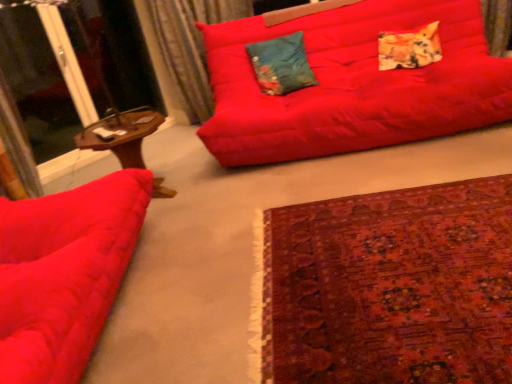
Find the location of a particular element. This screenshot has width=512, height=384. vacant space in carpet with intricate patterns at lower right (from a real-world perspective) is located at coordinates (372, 264).